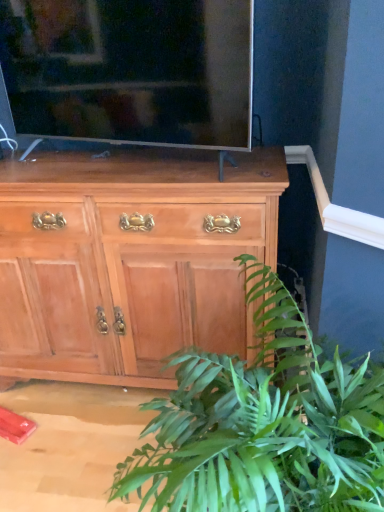
You are a GUI agent. You are given a task and a screenshot of the screen. Output one action in this format:
    pyautogui.click(x=<x>, y=<y>)
    Task: Click on the free space below matte black tv at upper center (from a real-world perspective)
    This screenshot has height=512, width=384.
    Given the screenshot: What is the action you would take?
    (x=140, y=167)